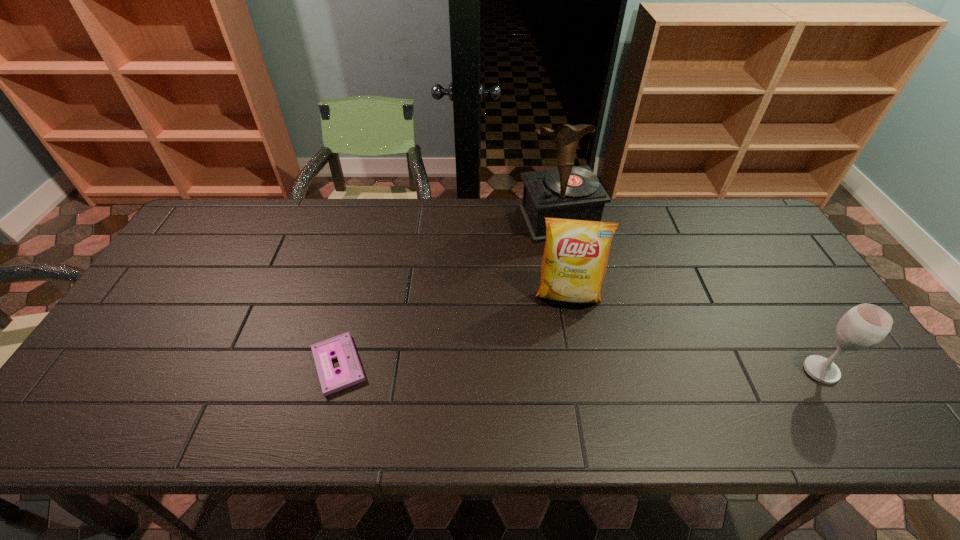
Locate an element on the screen. The height and width of the screenshot is (540, 960). free space located on the front-facing side of the crisp (potato chip) is located at coordinates (566, 341).

Find the location of a particular element. vacant space situated at the horn opening of the phonograph_record is located at coordinates (601, 303).

Image resolution: width=960 pixels, height=540 pixels. I want to click on free space located 0.200m at the horn opening of the phonograph_record, so click(x=594, y=289).

Locate an element on the screen. vacant space positioned at the horn opening of the phonograph_record is located at coordinates click(591, 285).

Identify the location of object that is at the far edge. Image resolution: width=960 pixels, height=540 pixels. (567, 192).

The image size is (960, 540). I want to click on videotape at the near edge, so click(350, 373).

In order to click on wineglass that is positioned at the near edge in this screenshot , I will do `click(864, 326)`.

What are the coordinates of `object at the right edge` in the screenshot? It's located at pyautogui.click(x=864, y=326).

Identify the location of object that is at the near right corner. (864, 326).

At what (x,y) coordinates should I click in order to perform the action: click on vacant space at the far edge of the desktop. Please return your answer as a coordinate pair (x, y). This screenshot has width=960, height=540. Looking at the image, I should click on (367, 205).